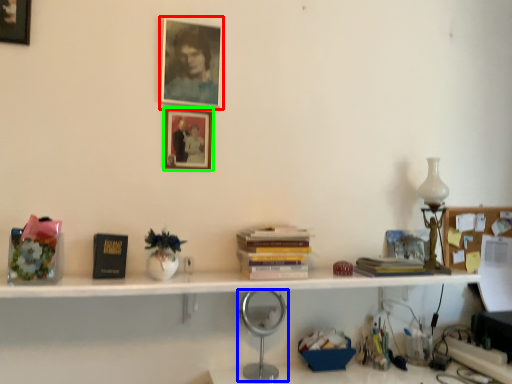
Question: Estimate the real-world distances between objects in this image. Which object is farther from picture frame (highlighted by a red box), table lamp (highlighted by a blue box) or picture frame (highlighted by a green box)?

Choices:
 (A) table lamp
 (B) picture frame

Answer: (A)